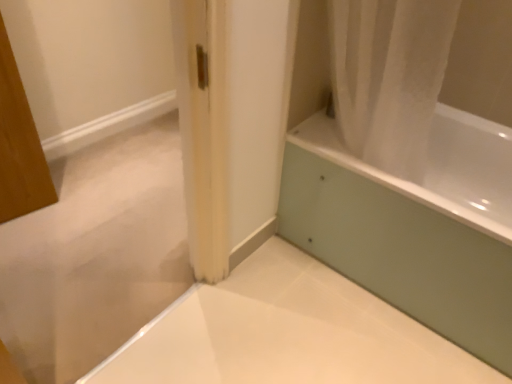
Question: Would you say white glossy bathtub at upper right is a long distance from white glossy bathtub at lower right?

Choices:
 (A) yes
 (B) no

Answer: (B)

Question: Is white glossy bathtub at upper right looking in the opposite direction of white glossy bathtub at lower right?

Choices:
 (A) yes
 (B) no

Answer: (B)

Question: Is white glossy bathtub at lower right surrounded by white glossy bathtub at upper right?

Choices:
 (A) no
 (B) yes

Answer: (A)

Question: Is white glossy bathtub at upper right at the right side of white glossy bathtub at lower right?

Choices:
 (A) yes
 (B) no

Answer: (B)

Question: Does white glossy bathtub at upper right appear on the left side of white glossy bathtub at lower right?

Choices:
 (A) yes
 (B) no

Answer: (A)

Question: Can you confirm if white glossy bathtub at upper right is wider than white glossy bathtub at lower right?

Choices:
 (A) yes
 (B) no

Answer: (B)

Question: From the image's perspective, is white glossy bathtub at lower right on white glossy bathtub at upper right?

Choices:
 (A) yes
 (B) no

Answer: (B)

Question: Is white glossy bathtub at lower right positioned with its back to white glossy bathtub at upper right?

Choices:
 (A) yes
 (B) no

Answer: (B)

Question: Does white glossy bathtub at lower right appear on the right side of white glossy bathtub at upper right?

Choices:
 (A) yes
 (B) no

Answer: (A)

Question: Is white glossy bathtub at lower right thinner than white glossy bathtub at upper right?

Choices:
 (A) no
 (B) yes

Answer: (A)

Question: Would you say white glossy bathtub at lower right contains white glossy bathtub at upper right?

Choices:
 (A) no
 (B) yes

Answer: (A)

Question: Is white glossy bathtub at lower right closer to the viewer compared to white glossy bathtub at upper right?

Choices:
 (A) no
 (B) yes

Answer: (A)

Question: Relative to white glossy bathtub at lower right, is white glossy bathtub at upper right in front or behind?

Choices:
 (A) behind
 (B) front

Answer: (B)